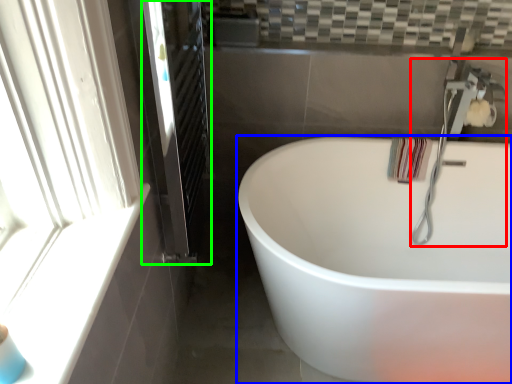
Question: Estimate the real-world distances between objects in this image. Which object is farther from faucet (highlighted by a red box), bathtub (highlighted by a blue box) or screen door (highlighted by a green box)?

Choices:
 (A) bathtub
 (B) screen door

Answer: (B)